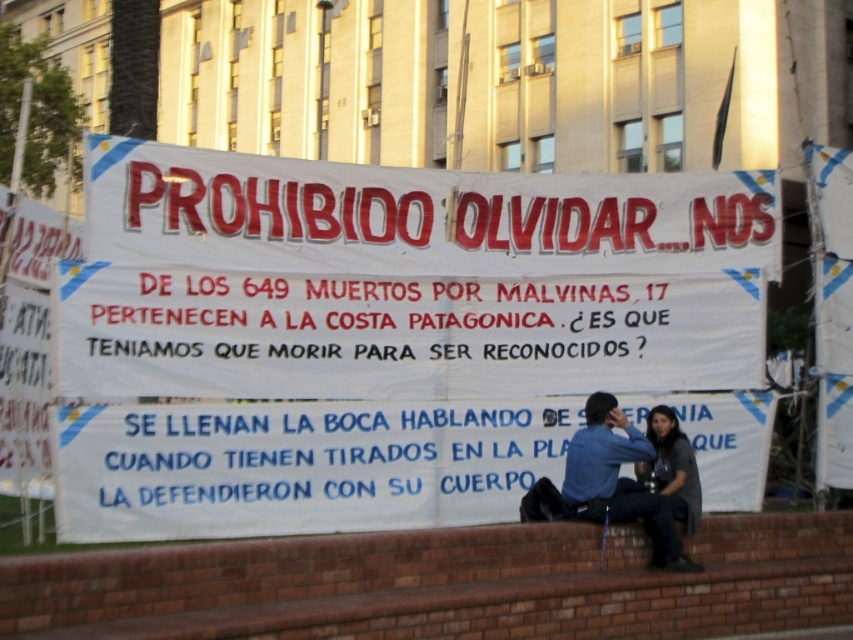
Who is higher up, white paper banner at center or dark gray fabric shirt at lower right?

Positioned higher is white paper banner at center.

Who is more forward, (743, 387) or (685, 522)?

Point (685, 522)

The width and height of the screenshot is (853, 640). In order to click on white paper banner at center in this screenshot , I will do `click(407, 280)`.

Is point (300, 577) less distant than point (602, 392)?

Yes, it is.

Identify the location of brick ledge at lower center. (444, 584).

Can you confirm if white paper banner at center is positioned to the right of brick ledge at lower center?

In fact, white paper banner at center is to the left of brick ledge at lower center.

Looking at this image, does white paper banner at center have a larger size compared to brick ledge at lower center?

Yes.

Is point (660, 273) positioned behind point (84, 570)?

Yes, it is.

I want to click on white paper banner at center, so click(407, 280).